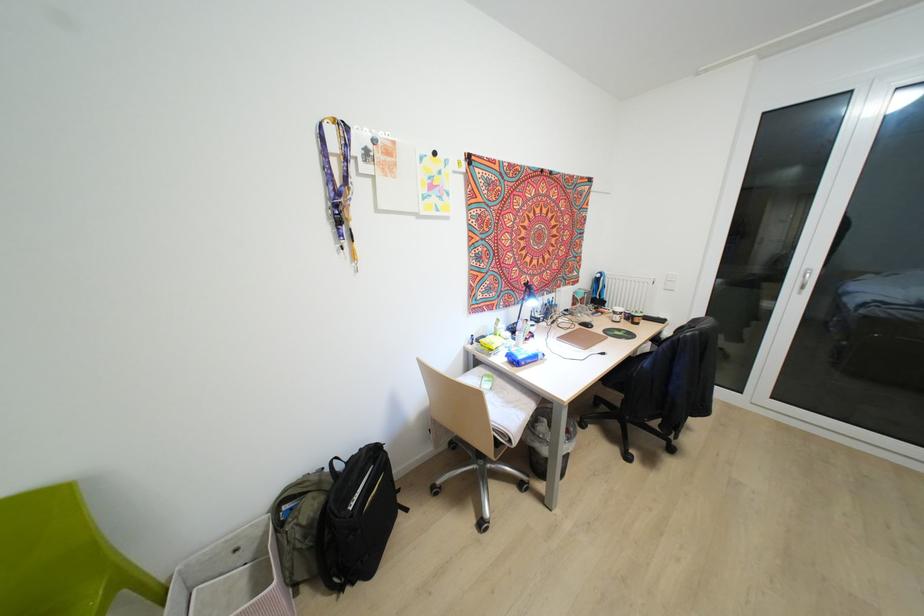
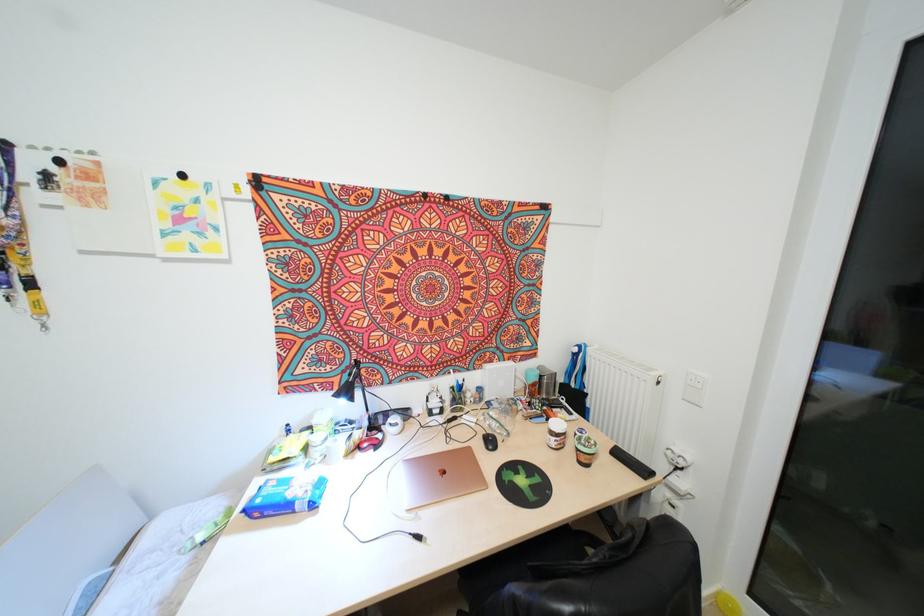
Where in the second image is the point corresponding to [661,320] from the first image?

(642, 471)